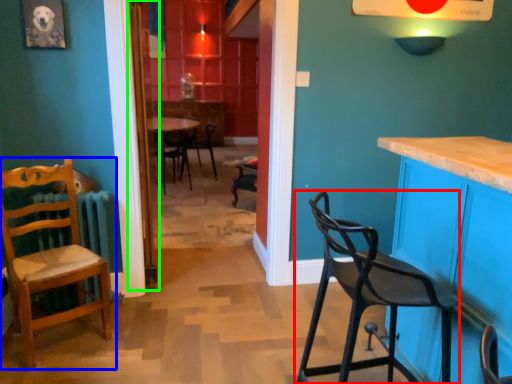
Question: Based on their relative distances, which object is farther from chair (highlighted by a red box)? Choose from chair (highlighted by a blue box) and door (highlighted by a green box).

Choices:
 (A) chair
 (B) door

Answer: (B)